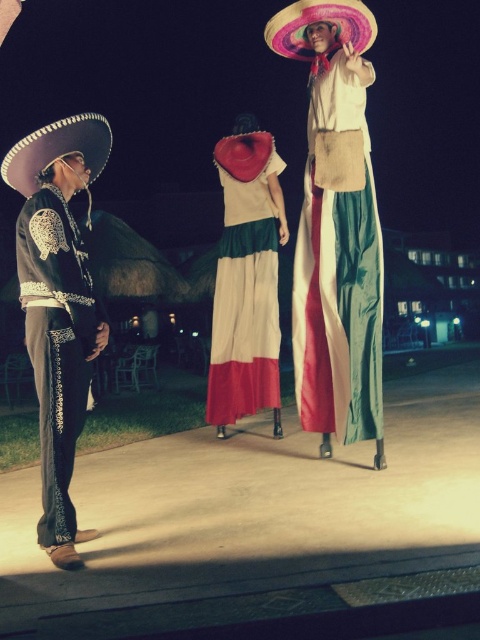
You are a photographer trying to capture both the matte fabric dress at center and the white cotton dress at center in a single frame. Which dress should you focus on first to ensure both are in the frame?

The matte fabric dress at center is in front of the white cotton dress at center, so you should focus on the matte fabric dress at center first to ensure both are in the frame.

In the nighttime scene, there is a white cotton dress at center and a multicolored felt sombrero at upper center. Which object is taller?

The white cotton dress at center is taller than the multicolored felt sombrero at upper center.

You are a photographer trying to capture the matte fabric dress at center and the black satin mariachi outfit at left in a single frame. Can you see both outfits clearly in your camera viewfinder?

The matte fabric dress at center is positioned over the black satin mariachi outfit at left, so the black satin mariachi outfit at left might be partially or fully obscured by the matte fabric dress at center in the camera viewfinder.